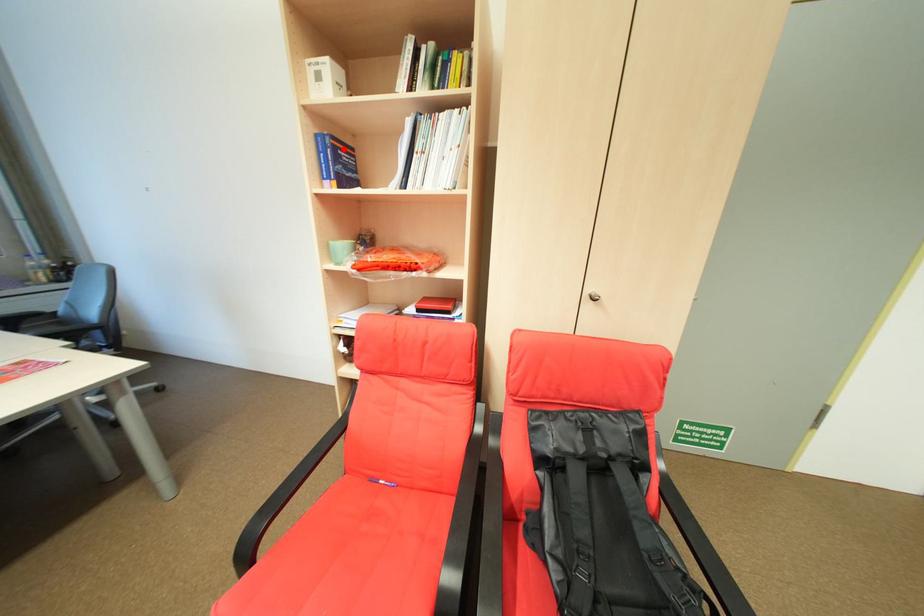
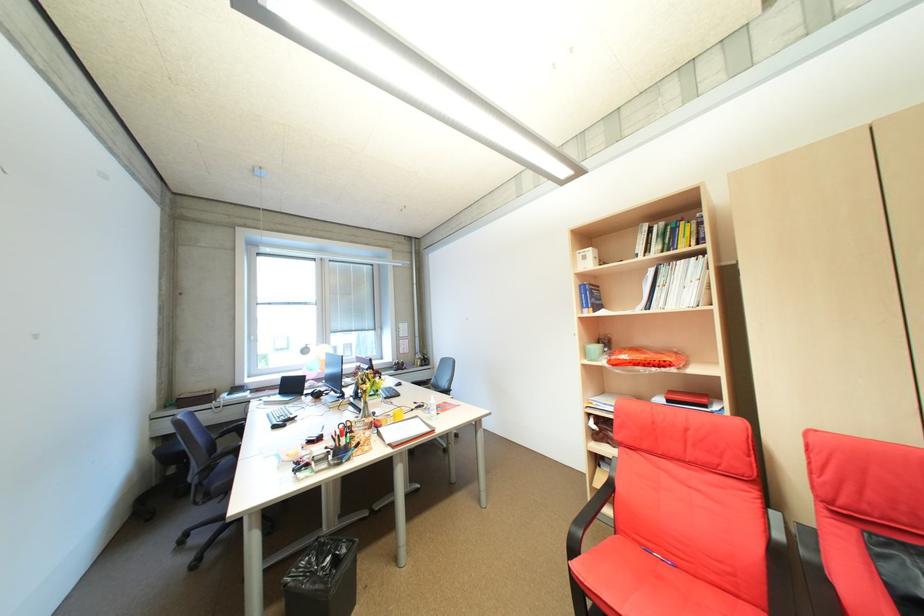
Where in the second image is the point corresponding to the highlighted location from the first image?

(600, 291)